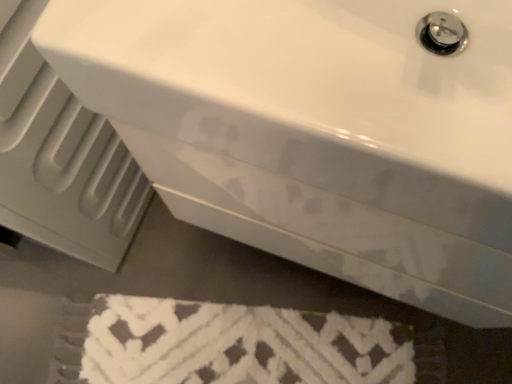
You are a GUI agent. You are given a task and a screenshot of the screen. Output one action in this format:
    pyautogui.click(x=<x>, y=<y>)
    Task: Click on the vacant point above white textured bath towel at lower center (from a real-world perspective)
    Image resolution: width=512 pixels, height=384 pixels.
    Given the screenshot: What is the action you would take?
    click(263, 351)